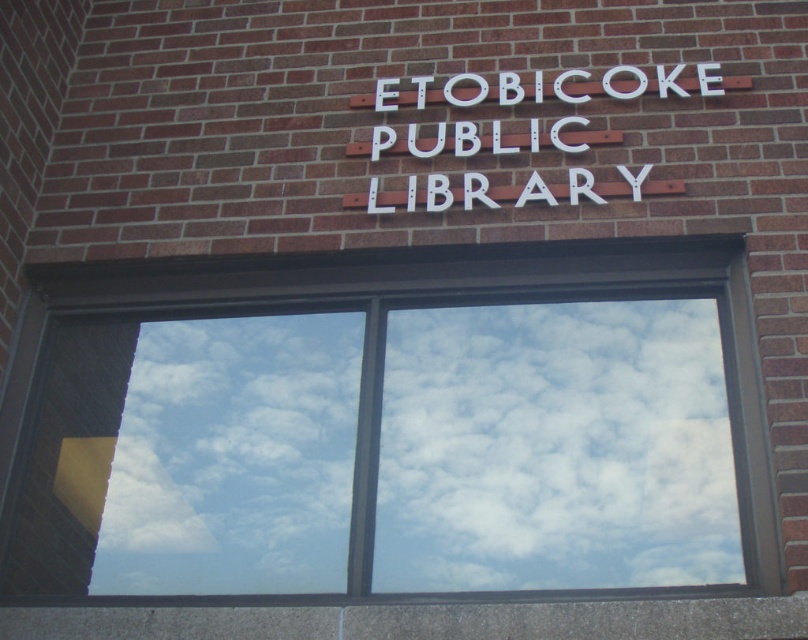
Image resolution: width=808 pixels, height=640 pixels. What do you see at coordinates (389, 428) in the screenshot?
I see `transparent glass window at center` at bounding box center [389, 428].

Does point (32, 356) come in front of point (489, 192)?

Yes, it is.

The width and height of the screenshot is (808, 640). Describe the element at coordinates (389, 428) in the screenshot. I see `transparent glass window at center` at that location.

You are a GUI agent. You are given a task and a screenshot of the screen. Output one action in this format:
    pyautogui.click(x=<x>, y=<y>)
    Task: Click on the transparent glass window at center
    This screenshot has width=808, height=640.
    Given the screenshot: What is the action you would take?
    pyautogui.click(x=389, y=428)